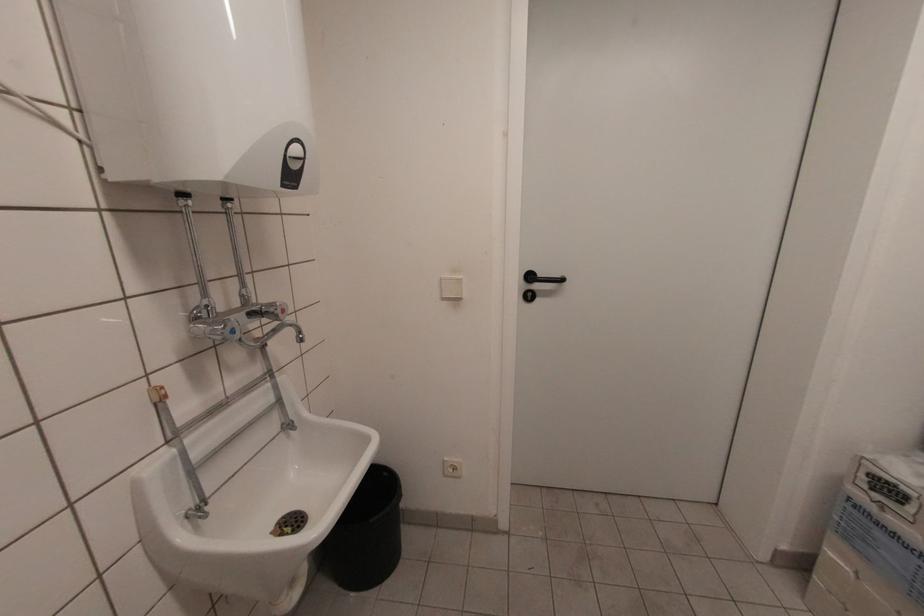
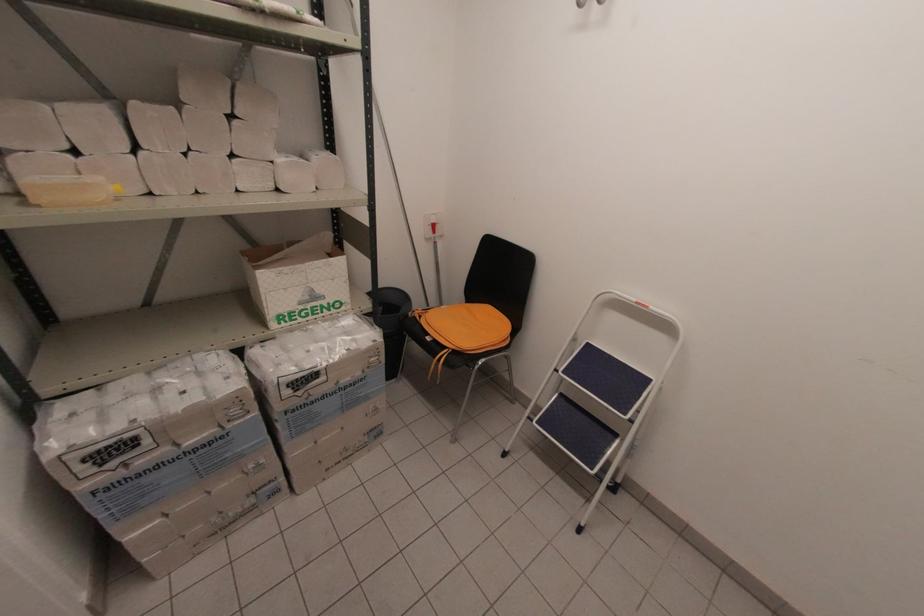
The point at (869, 476) is marked in the first image. Where is the corresponding point in the second image?

(84, 463)